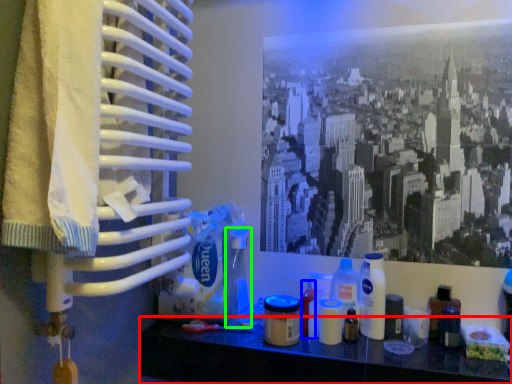
Question: Which object is positioned closest to furniture (highlighted by a red box)? Select from toiletry (highlighted by a blue box) and toiletry (highlighted by a green box).

Choices:
 (A) toiletry
 (B) toiletry

Answer: (A)